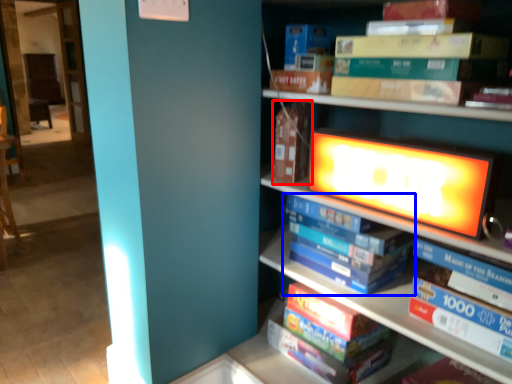
Question: Which of the following is the farthest to the observer, paperback book (highlighted by a red box) or book (highlighted by a blue box)?

Choices:
 (A) paperback book
 (B) book

Answer: (A)